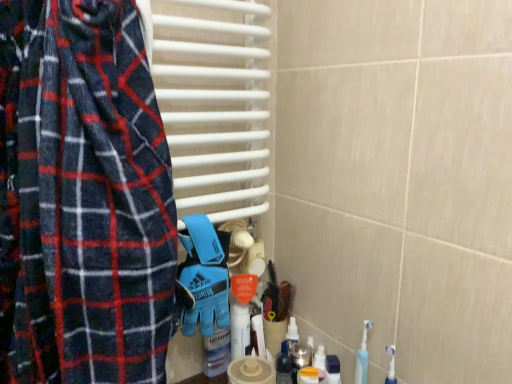
Describe the element at coordinates (239, 330) in the screenshot. I see `white glossy bottle at center` at that location.

Identify the location of white glossy bottle at center. Image resolution: width=512 pixels, height=384 pixels. (239, 330).

Does translucent plastic bottle at lower center come behind blue synthetic glove at center?

Yes, it is behind blue synthetic glove at center.

Are translucent plastic bottle at lower center and blue synthetic glove at center located far from each other?

No.

Is translucent plastic bottle at lower center spatially inside blue synthetic glove at center, or outside of it?

translucent plastic bottle at lower center is not enclosed by blue synthetic glove at center.

Does translucent plastic bottle at lower center have a greater width compared to blue synthetic glove at center?

In fact, translucent plastic bottle at lower center might be narrower than blue synthetic glove at center.

Between point (193, 252) and point (282, 379), which one is positioned in front?

The point (193, 252) is closer to the camera.

Visually, is blue synthetic glove at center positioned to the left or to the right of translucent plastic bottle at lower center?

Clearly, blue synthetic glove at center is on the left of translucent plastic bottle at lower center in the image.

Which of these two, blue synthetic glove at center or translucent plastic bottle at lower center, is thinner?

translucent plastic bottle at lower center.

How many degrees apart are the facing directions of blue synthetic glove at center and translucent plastic bottle at lower center?

The angle between the facing direction of blue synthetic glove at center and the facing direction of translucent plastic bottle at lower center is 90 degrees.

Who is taller, blue synthetic glove at center or white glossy bottle at center?

blue synthetic glove at center is taller.

Is blue synthetic glove at center not near white glossy bottle at center?

blue synthetic glove at center is actually quite close to white glossy bottle at center.

Considering the relative positions of blue synthetic glove at center and white glossy bottle at center in the image provided, is blue synthetic glove at center to the right of white glossy bottle at center from the viewer's perspective?

Incorrect, blue synthetic glove at center is not on the right side of white glossy bottle at center.

Considering the relative positions of white glossy bottle at center and translucent plastic bottle at lower center in the image provided, is white glossy bottle at center to the right of translucent plastic bottle at lower center from the viewer's perspective?

Incorrect, white glossy bottle at center is not on the right side of translucent plastic bottle at lower center.

Is the position of white glossy bottle at center more distant than that of translucent plastic bottle at lower center?

Yes, white glossy bottle at center is behind translucent plastic bottle at lower center.

Is there a large distance between white glossy bottle at center and translucent plastic bottle at lower center?

white glossy bottle at center is near translucent plastic bottle at lower center, not far away.

Is translucent plastic bottle at lower center to the left or to the right of white glossy bottle at center in the image?

From the image, it's evident that translucent plastic bottle at lower center is to the right of white glossy bottle at center.

Based on the photo, does translucent plastic bottle at lower center contain white glossy bottle at center?

No, white glossy bottle at center is not surrounded by translucent plastic bottle at lower center.

Would you consider translucent plastic bottle at lower center to be distant from white glossy bottle at center?

translucent plastic bottle at lower center is actually quite close to white glossy bottle at center.

Relative to blue synthetic glove at center, is white glossy bottle at center in front or behind?

Visually, white glossy bottle at center is located behind blue synthetic glove at center.

Is white glossy bottle at center smaller than blue synthetic glove at center?

Indeed, white glossy bottle at center has a smaller size compared to blue synthetic glove at center.

How different are the orientations of white glossy bottle at center and blue synthetic glove at center in degrees?

The angular difference between white glossy bottle at center and blue synthetic glove at center is 0.000257 degrees.

Is white glossy bottle at center not within blue synthetic glove at center?

Yes, white glossy bottle at center is outside of blue synthetic glove at center.

Where is `blanket above the translucent plastic bottle at lower center (from a real-world perspective)`? blanket above the translucent plastic bottle at lower center (from a real-world perspective) is located at coordinates (205, 276).

This screenshot has width=512, height=384. Identify the location of blanket lying above the translucent plastic bottle at lower center (from the image's perspective). pyautogui.click(x=205, y=276).

Considering their positions, is white glossy bottle at center positioned closer to translucent plastic bottle at lower center than blue synthetic glove at center?

white glossy bottle at center is closer to translucent plastic bottle at lower center.

Estimate the real-world distances between objects in this image. Which object is closer to blue synthetic glove at center, white glossy bottle at center or translucent plastic bottle at lower center?

The object closer to blue synthetic glove at center is white glossy bottle at center.

Which object lies further to the anchor point blue synthetic glove at center, translucent plastic bottle at lower center or white glossy bottle at center?

Based on the image, translucent plastic bottle at lower center appears to be further to blue synthetic glove at center.

Based on their spatial positions, is blue synthetic glove at center or white glossy bottle at center closer to translucent plastic bottle at lower center?

white glossy bottle at center is positioned closer to the anchor translucent plastic bottle at lower center.

From the image, which object appears to be farther from white glossy bottle at center, translucent plastic bottle at lower center or blue synthetic glove at center?

blue synthetic glove at center lies further to white glossy bottle at center than the other object.

When comparing their distances from white glossy bottle at center, does blue synthetic glove at center or translucent plastic bottle at lower center seem further?

Among the two, blue synthetic glove at center is located further to white glossy bottle at center.

Image resolution: width=512 pixels, height=384 pixels. I want to click on cleaning product that lies between blue synthetic glove at center and translucent plastic bottle at lower center from top to bottom, so click(x=239, y=330).